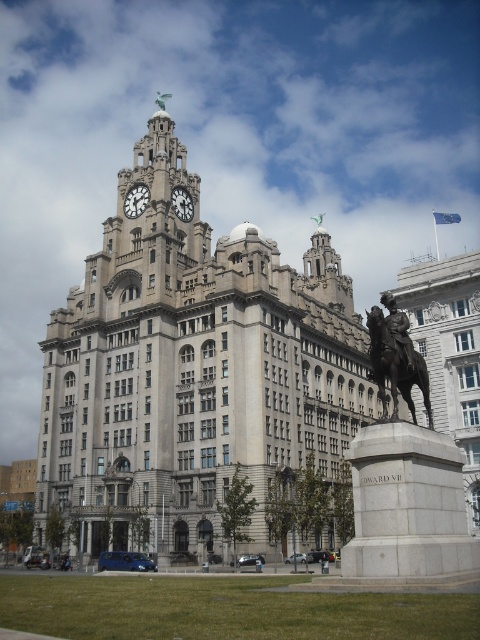
Where is `bronze statue at lower right`? bronze statue at lower right is located at coordinates (398, 326).

Where is `bronze statue at lower right`? The height and width of the screenshot is (640, 480). bronze statue at lower right is located at coordinates (398, 326).

Which is above, shiny bronze horse at center-right or bronze statue at lower right?

Positioned higher is bronze statue at lower right.

Which is in front, point (385, 374) or point (394, 324)?

Positioned in front is point (385, 374).

Is point (380, 342) more distant than point (391, 312)?

No, (380, 342) is in front of (391, 312).

Identify the location of shiny bronze horse at center-right. (396, 365).

Can you confirm if shiny bronze horse at center-right is positioned to the right of white stone clock at center?

Yes, shiny bronze horse at center-right is to the right of white stone clock at center.

How far apart are shiny bronze horse at center-right and white stone clock at center?

A distance of 42.17 meters exists between shiny bronze horse at center-right and white stone clock at center.

Where is `shiny bronze horse at center-right`? The height and width of the screenshot is (640, 480). shiny bronze horse at center-right is located at coordinates (396, 365).